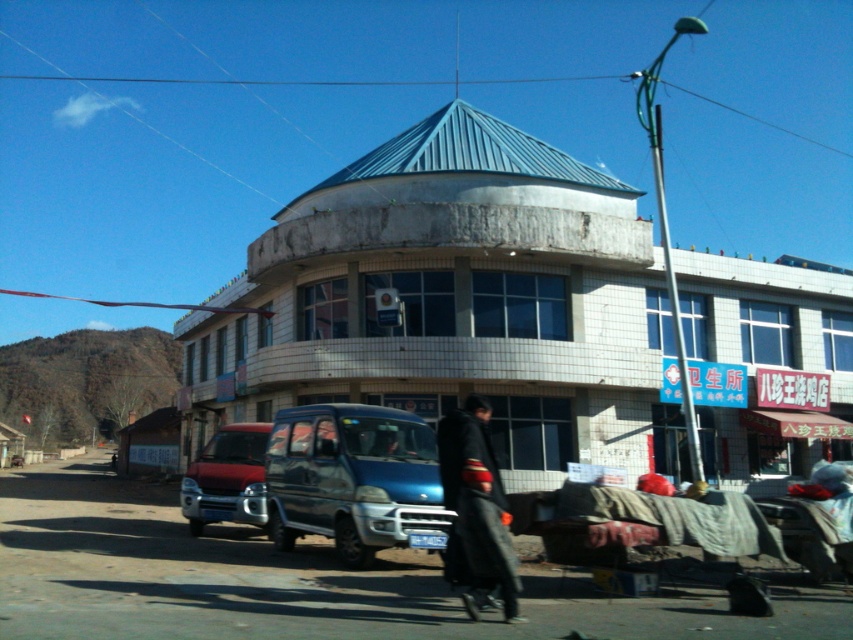
Question: Which of the following is the farthest from the observer?

Choices:
 (A) black matte robe at center
 (B) matte red van at center

Answer: (B)

Question: Among these points, which one is nearest to the camera?

Choices:
 (A) (496, 492)
 (B) (198, 528)
 (C) (427, 538)

Answer: (A)

Question: Does blue metallic van at center appear under matte red van at center?

Choices:
 (A) yes
 (B) no

Answer: (B)

Question: Is blue metallic van at center positioned behind black matte robe at center?

Choices:
 (A) no
 (B) yes

Answer: (B)

Question: Which point appears closest to the camera in this image?

Choices:
 (A) [460, 440]
 (B) [184, 474]

Answer: (A)

Question: Does blue metallic van at center appear on the right side of black matte robe at center?

Choices:
 (A) no
 (B) yes

Answer: (A)